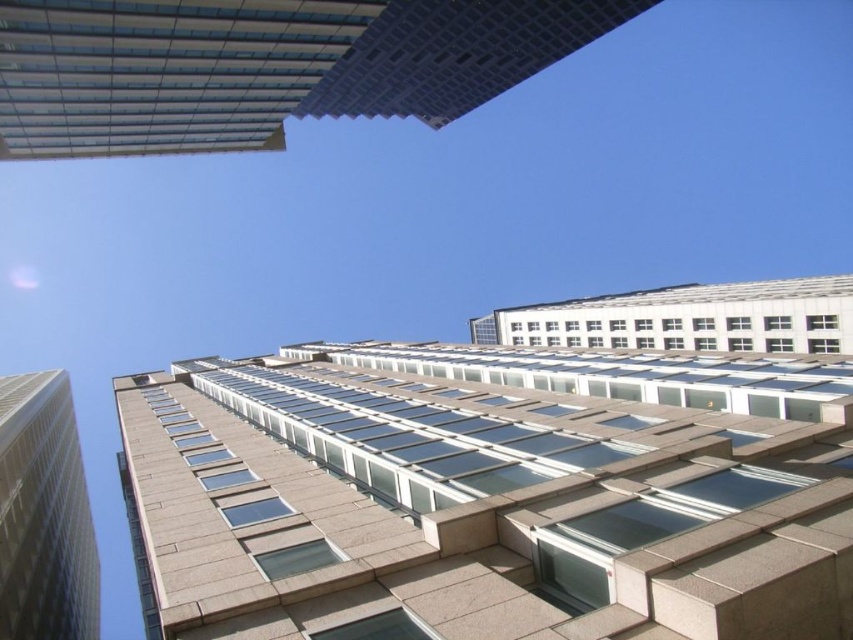
Question: Is glassy concrete skyscraper at upper left wider than beige stone tower at left?

Choices:
 (A) no
 (B) yes

Answer: (B)

Question: Among these points, which one is nearest to the camera?

Choices:
 (A) (24, 481)
 (B) (410, 74)

Answer: (A)

Question: Does glassy concrete skyscraper at upper left appear on the right side of beige stone tower at left?

Choices:
 (A) no
 (B) yes

Answer: (B)

Question: From the image, what is the correct spatial relationship of glassy concrete skyscraper at upper left in relation to beige stone tower at left?

Choices:
 (A) below
 (B) above

Answer: (B)